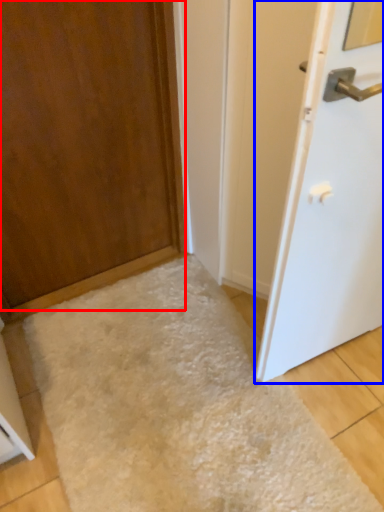
Question: Among these objects, which one is nearest to the camera, door (highlighted by a red box) or door (highlighted by a blue box)?

Choices:
 (A) door
 (B) door

Answer: (B)